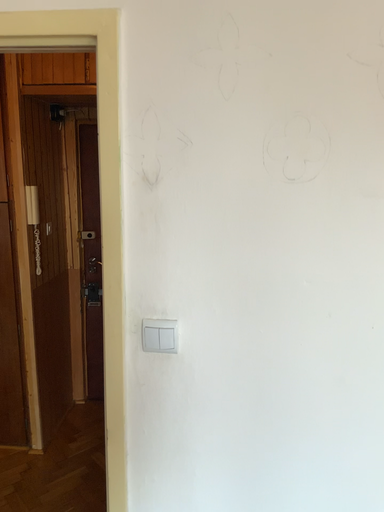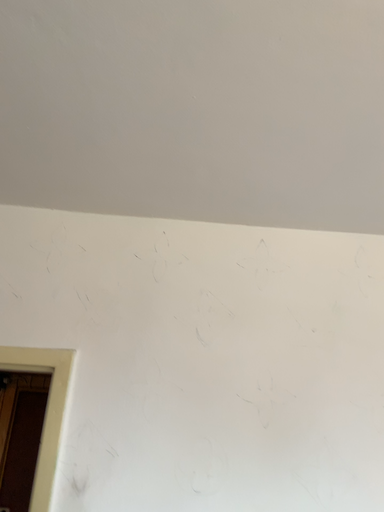
Question: How did the camera likely rotate when shooting the video?

Choices:
 (A) rotated upward
 (B) rotated downward

Answer: (A)